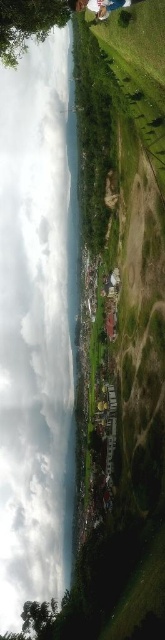
In the scene shown: Which is below, green leafy tree at upper left or green leafy tree at lower left?

green leafy tree at lower left is below.

Does green leafy tree at upper left appear under green leafy tree at lower left?

No.

Image resolution: width=165 pixels, height=640 pixels. What do you see at coordinates (28, 22) in the screenshot?
I see `green leafy tree at upper left` at bounding box center [28, 22].

Where is `green leafy tree at upper left`? The width and height of the screenshot is (165, 640). green leafy tree at upper left is located at coordinates (28, 22).

Can you confirm if transparent water at center is thinner than green leafy tree at lower left?

In fact, transparent water at center might be wider than green leafy tree at lower left.

Measure the distance between transparent water at center and green leafy tree at lower left.

transparent water at center and green leafy tree at lower left are 192.73 feet apart from each other.

The image size is (165, 640). What do you see at coordinates (36, 323) in the screenshot?
I see `transparent water at center` at bounding box center [36, 323].

Image resolution: width=165 pixels, height=640 pixels. Identify the location of transparent water at center. (36, 323).

Does transparent water at center have a lesser height compared to green leafy tree at upper left?

No.

Between point (22, 204) and point (15, 20), which one is positioned in front?

Point (15, 20) is more forward.

At what (x,y) coordinates should I click in order to perform the action: click on transparent water at center. Please return your answer as a coordinate pair (x, y). This screenshot has height=640, width=165. Looking at the image, I should click on (36, 323).